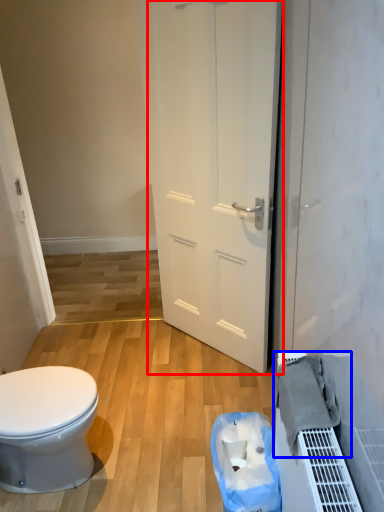
Question: Which object is closer to the camera taking this photo, door (highlighted by a red box) or material (highlighted by a blue box)?

Choices:
 (A) door
 (B) material

Answer: (B)